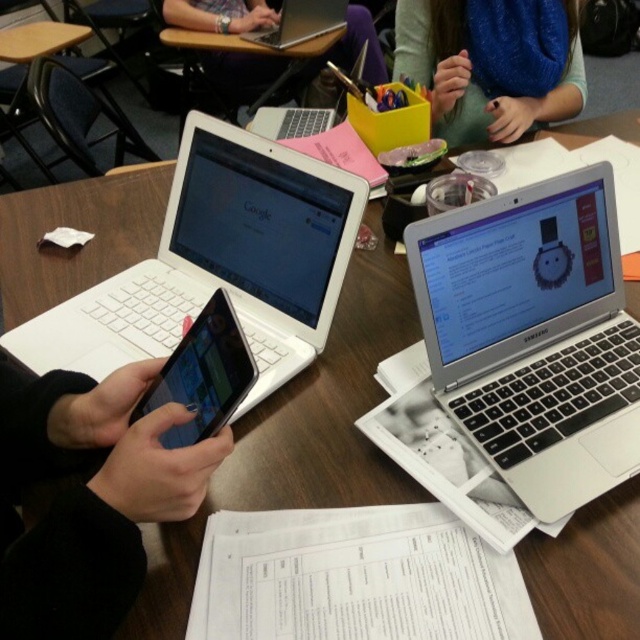
Does silver metallic laptop at center-right have a greater height compared to matte black laptop at upper center?

No, silver metallic laptop at center-right is not taller than matte black laptop at upper center.

Between point (627, 323) and point (205, 17), which one is positioned in front?

Point (627, 323) is more forward.

Is point (608, 465) farther from viewer compared to point (234, 77)?

No, (608, 465) is closer to viewer.

This screenshot has height=640, width=640. In order to click on silver metallic laptop at center-right in this screenshot , I will do `click(534, 336)`.

Is silver metallic laptop at center-right in front of black glossy tablet at center?

No, silver metallic laptop at center-right is further to the viewer.

Between silver metallic laptop at center-right and black glossy tablet at center, which one has less height?

Standing shorter between the two is black glossy tablet at center.

At what (x,y) coordinates should I click in order to perform the action: click on silver metallic laptop at center-right. Please return your answer as a coordinate pair (x, y). The image size is (640, 640). Looking at the image, I should click on (534, 336).

Can you confirm if white matte laptop at left is wider than matte black laptop at upper center?

No, white matte laptop at left is not wider than matte black laptop at upper center.

Describe the element at coordinates (218, 262) in the screenshot. The height and width of the screenshot is (640, 640). I see `white matte laptop at left` at that location.

Locate an element on the screen. white matte laptop at left is located at coordinates (218, 262).